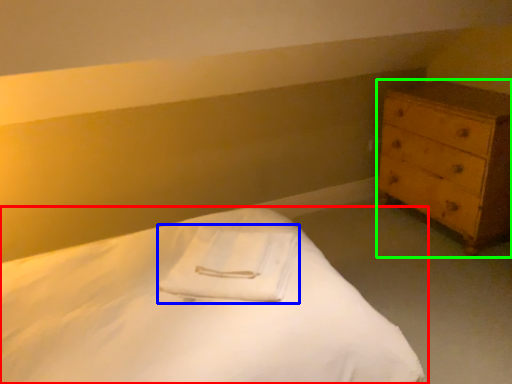
Question: Which object is positioned farthest from bed (highlighted by a red box)? Select from cloth (highlighted by a blue box) and chest of drawers (highlighted by a green box).

Choices:
 (A) cloth
 (B) chest of drawers

Answer: (B)